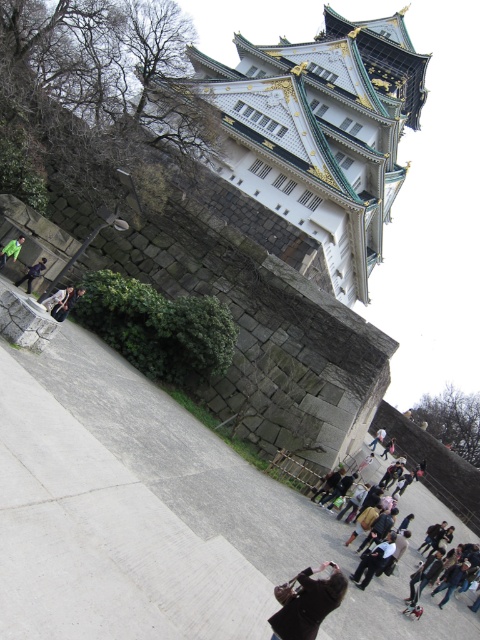
Question: Among these objects, which one is nearest to the camera?

Choices:
 (A) white stone tower at upper center
 (B) matte black jacket at lower center
 (C) dark gray fabric jacket at lower center

Answer: (C)

Question: Which point is farther to the camera?

Choices:
 (A) (69, 289)
 (B) (22, 282)
 (C) (237, 109)
 (D) (384, 561)

Answer: (C)

Question: Is dark brown leather coat at center wider than dark blue jeans at lower left?

Choices:
 (A) no
 (B) yes

Answer: (A)

Question: Is matte black jacket at lower center behind green fabric jacket at lower center?

Choices:
 (A) yes
 (B) no

Answer: (B)

Question: Does dark blue jeans at lower left appear on the right side of green fabric jacket at lower center?

Choices:
 (A) yes
 (B) no

Answer: (A)

Question: Which object is the closest to the matte black jacket at lower center?

Choices:
 (A) dark gray fabric jacket at lower center
 (B) green fabric jacket at lower center

Answer: (B)